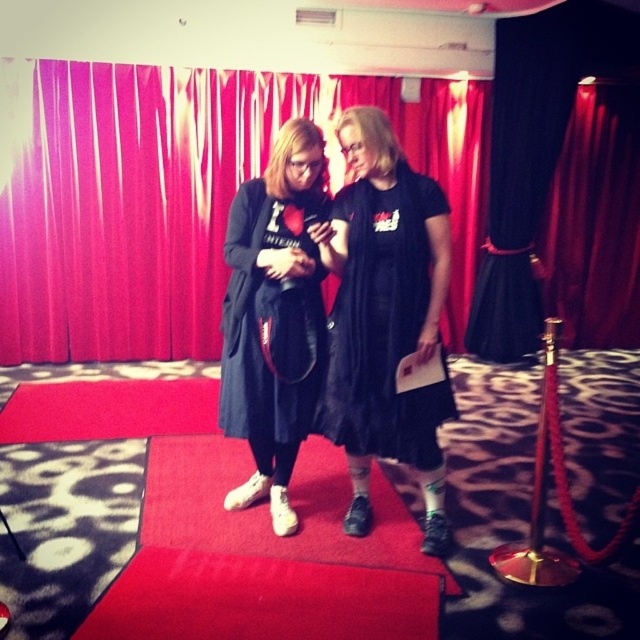
Describe the element at coordinates (129, 208) in the screenshot. I see `red velvet curtain at center` at that location.

Is the position of red velvet curtain at center less distant than that of black matte dress at center?

No, red velvet curtain at center is further to the viewer.

Is point (54, 204) farther from camera compared to point (442, 401)?

Yes, it is behind point (442, 401).

Locate an element on the screen. The width and height of the screenshot is (640, 640). red velvet curtain at center is located at coordinates (129, 208).

Is matte black dress at center taller than black matte dress at center?

Yes.

Does matte black dress at center appear on the right side of black matte dress at center?

In fact, matte black dress at center is to the left of black matte dress at center.

Identify the location of matte black dress at center. The width and height of the screenshot is (640, 640). (275, 316).

The image size is (640, 640). In order to click on matte black dress at center in this screenshot , I will do `click(275, 316)`.

Consider the image. How far apart are red velvet curtain at center and matte black dress at center?

9.07 feet

Can you confirm if red velvet curtain at center is positioned below matte black dress at center?

Actually, red velvet curtain at center is above matte black dress at center.

Identify the location of red velvet curtain at center. Image resolution: width=640 pixels, height=640 pixels. (129, 208).

Locate an element on the screen. red velvet curtain at center is located at coordinates (129, 208).